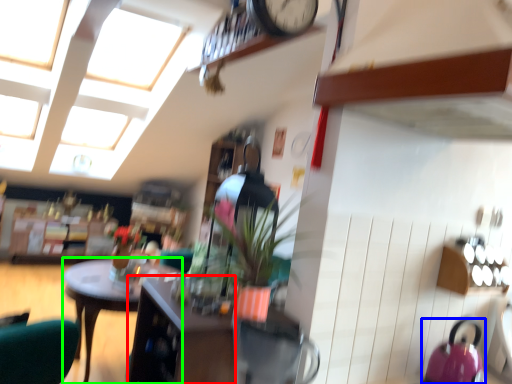
Question: Which is nearer to the cabinetry (highlighted by a red box)? kettle (highlighted by a blue box) or desk (highlighted by a green box).

Choices:
 (A) kettle
 (B) desk

Answer: (A)